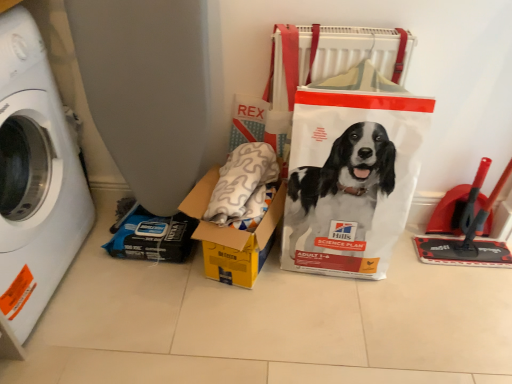
Identify the location of free spot to the right of yellow cardboard box at center. The width and height of the screenshot is (512, 384). (301, 297).